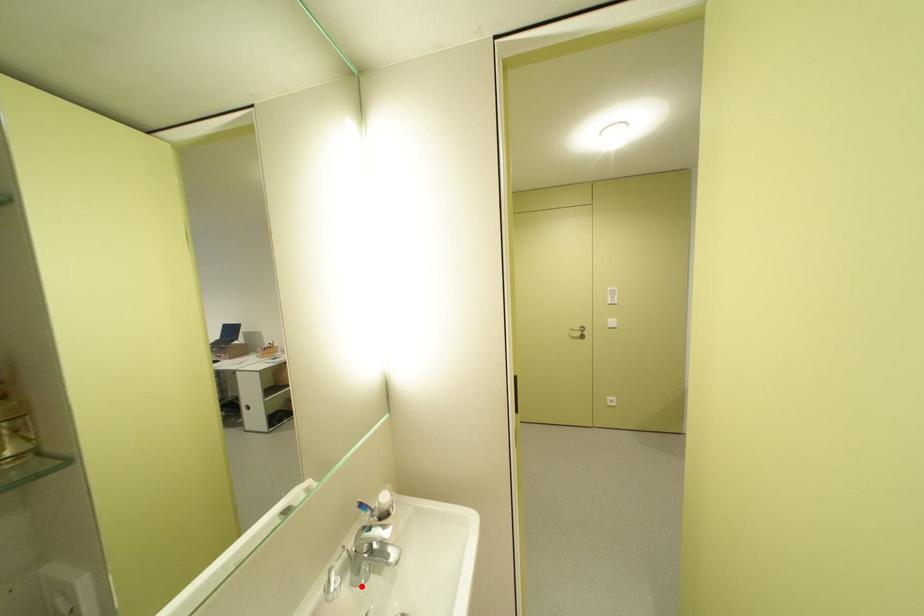
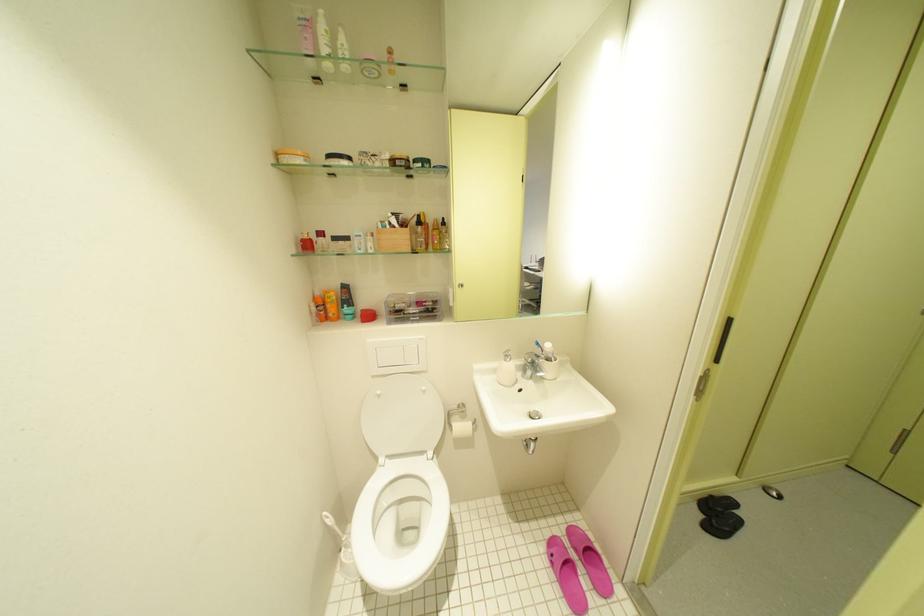
Find the pixel in the second image that matches the highlighted location in the first image.

(531, 378)